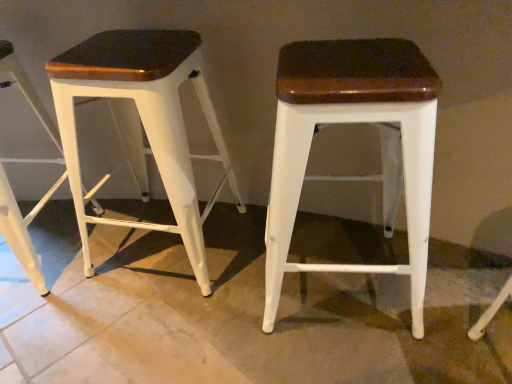
Question: Should I look upward or downward to see matte white stool at center, positioned as the first stool in right-to-left order?

Choices:
 (A) down
 (B) up

Answer: (B)

Question: Does matte white stool at center, the third stool when ordered from left to right, touch matte white stool at left, which is the 1th stool from left to right?

Choices:
 (A) yes
 (B) no

Answer: (B)

Question: Is matte white stool at center, the third stool when ordered from left to right, further to camera compared to matte white stool at left, marked as the third stool in a right-to-left arrangement?

Choices:
 (A) yes
 (B) no

Answer: (B)

Question: Is matte white stool at left, which is the 1th stool from left to right, completely or partially inside matte white stool at center, the third stool when ordered from left to right?

Choices:
 (A) no
 (B) yes

Answer: (A)

Question: Can you confirm if matte white stool at center, the third stool when ordered from left to right, is bigger than matte white stool at left, which is the 1th stool from left to right?

Choices:
 (A) yes
 (B) no

Answer: (B)

Question: From the image's perspective, is matte white stool at center, the third stool when ordered from left to right, on top of matte white stool at left, which is the 1th stool from left to right?

Choices:
 (A) no
 (B) yes

Answer: (A)

Question: Is matte white stool at center, positioned as the first stool in right-to-left order, turned away from matte white stool at left, marked as the third stool in a right-to-left arrangement?

Choices:
 (A) no
 (B) yes

Answer: (A)

Question: From the image's perspective, would you say matte white stool at left, which is counted as the 2th stool, starting from the left, is shown under matte white stool at center, positioned as the first stool in right-to-left order?

Choices:
 (A) no
 (B) yes

Answer: (A)

Question: Is matte white stool at left, which is counted as the 2th stool, starting from the left, looking in the opposite direction of matte white stool at center, the third stool when ordered from left to right?

Choices:
 (A) yes
 (B) no

Answer: (B)

Question: From a real-world perspective, is matte white stool at left, which is counted as the 2th stool, starting from the left, positioned over matte white stool at center, positioned as the first stool in right-to-left order, based on gravity?

Choices:
 (A) yes
 (B) no

Answer: (A)

Question: From the image's perspective, is matte white stool at left, which is the second stool from right to left, on matte white stool at center, positioned as the first stool in right-to-left order?

Choices:
 (A) yes
 (B) no

Answer: (A)

Question: Is matte white stool at left, which is the second stool from right to left, not close to matte white stool at center, the third stool when ordered from left to right?

Choices:
 (A) no
 (B) yes

Answer: (A)

Question: Does matte white stool at left, which is counted as the 2th stool, starting from the left, have a greater width compared to matte white stool at center, positioned as the first stool in right-to-left order?

Choices:
 (A) yes
 (B) no

Answer: (B)

Question: Is matte white stool at left, which is counted as the 2th stool, starting from the left, oriented away from matte white stool at left, marked as the third stool in a right-to-left arrangement?

Choices:
 (A) yes
 (B) no

Answer: (B)